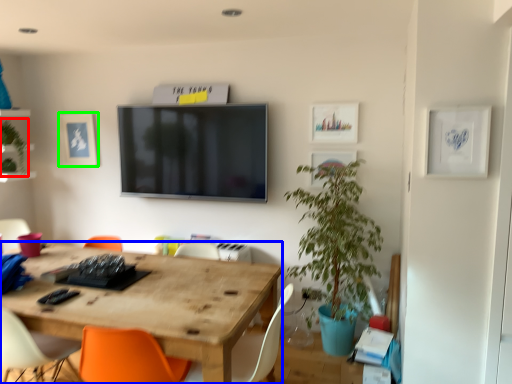
Question: Which object is positioned closest to plant (highlighted by a red box)? Select from desk (highlighted by a blue box) and picture frame (highlighted by a green box).

Choices:
 (A) desk
 (B) picture frame

Answer: (B)